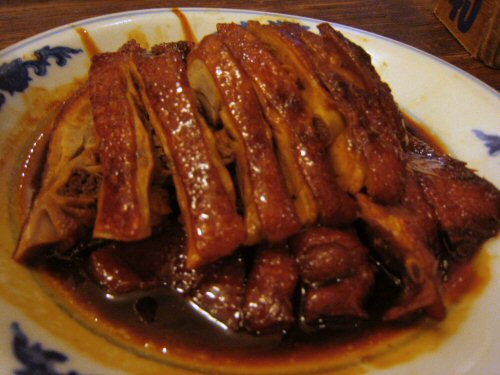
At what (x,y) coordinates should I click in order to perform the action: click on wooden table. Please return your answer as a coordinate pair (x, y). The width and height of the screenshot is (500, 375). Looking at the image, I should click on (413, 17).